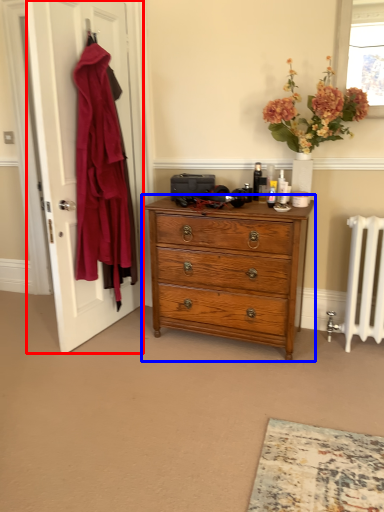
Question: Which point is closer to the camera, door (highlighted by a red box) or chest of drawers (highlighted by a blue box)?

Choices:
 (A) door
 (B) chest of drawers

Answer: (A)